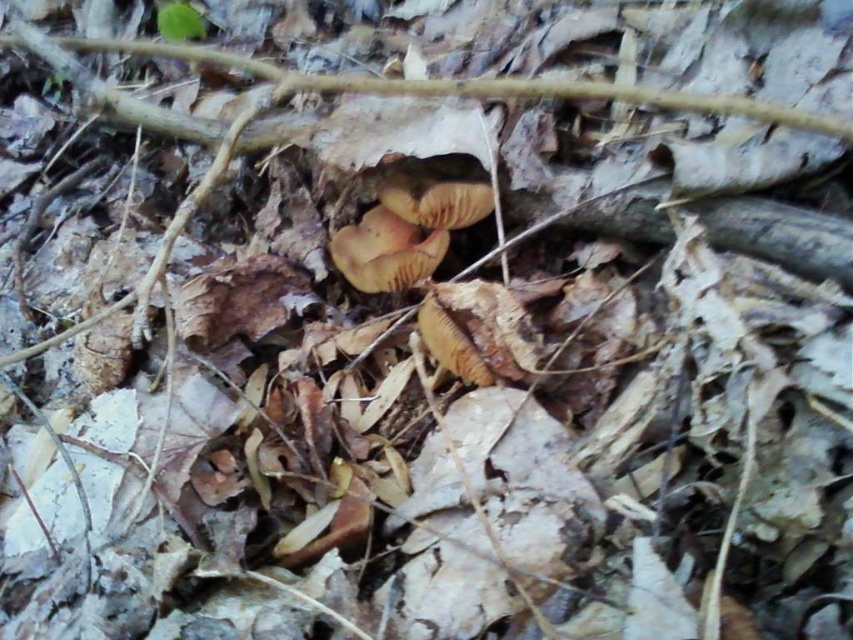
Between brown matte fungi at center and smooth orange cap at center, which one has less height?

With less height is smooth orange cap at center.

Which of these two, brown matte fungi at center or smooth orange cap at center, stands taller?

brown matte fungi at center is taller.

This screenshot has width=853, height=640. In order to click on brown matte fungi at center in this screenshot , I will do `click(386, 252)`.

Locate an element on the screen. Image resolution: width=853 pixels, height=640 pixels. brown matte fungi at center is located at coordinates (386, 252).

Which is more to the left, brown matte fungi at center or brown fuzzy mushroom at center?

brown matte fungi at center

Is brown matte fungi at center wider than brown fuzzy mushroom at center?

Indeed, brown matte fungi at center has a greater width compared to brown fuzzy mushroom at center.

Who is more forward, (364, 234) or (430, 301)?

Positioned in front is point (430, 301).

Where is `brown matte fungi at center`? This screenshot has height=640, width=853. brown matte fungi at center is located at coordinates (386, 252).

Is brown matte twig at upper center above brown fuzzy mushroom at center?

Yes.

Who is more forward, (767, 104) or (462, 342)?

Point (767, 104) is more forward.

Is point (437, 93) farther from viewer compared to point (479, 381)?

That is True.

The image size is (853, 640). Find the location of `brown matte twig at upper center`. brown matte twig at upper center is located at coordinates (476, 84).